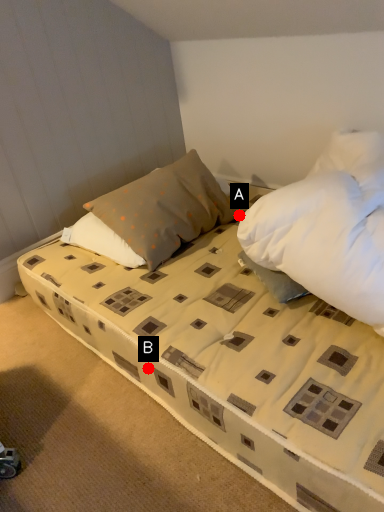
Question: Two points are circled on the image, labeled by A and B beside each circle. Which point is closer to the camera taking this photo?

Choices:
 (A) A is closer
 (B) B is closer

Answer: (B)